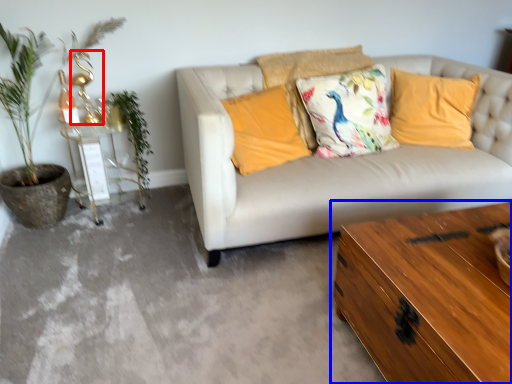
Question: Which object appears closest to the camera in this image, table lamp (highlighted by a red box) or table (highlighted by a blue box)?

Choices:
 (A) table lamp
 (B) table

Answer: (B)